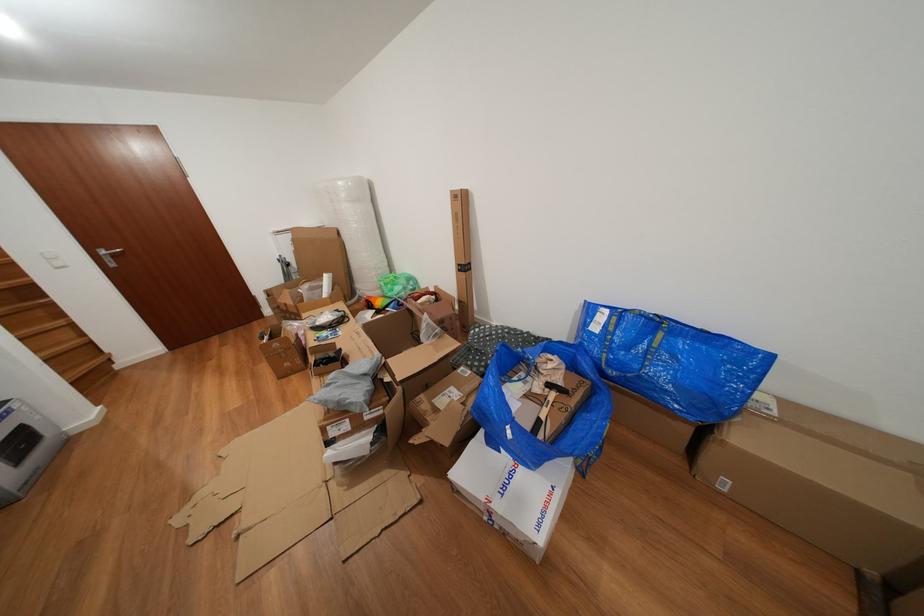
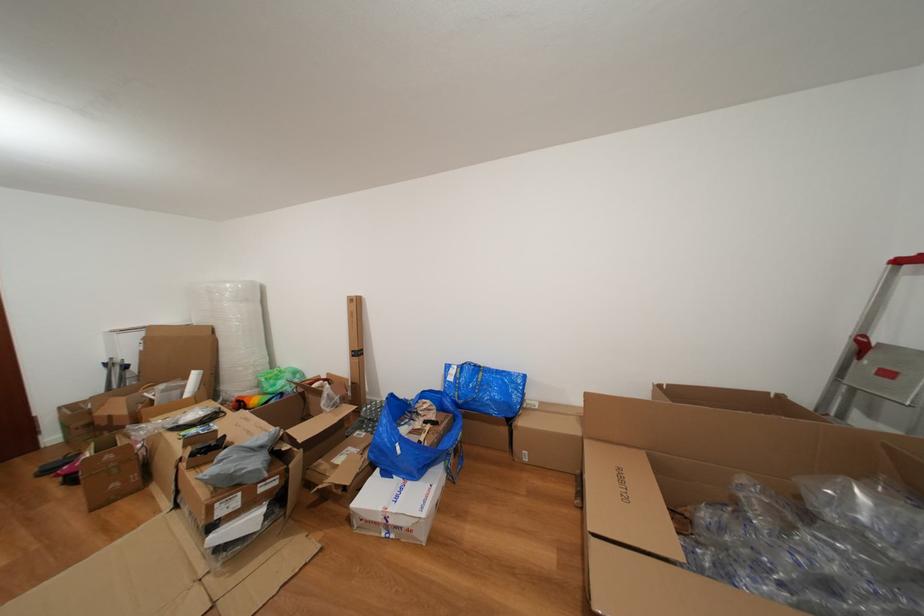
Locate, in the second image, the point that corresponds to (602,334) in the first image.

(458, 384)